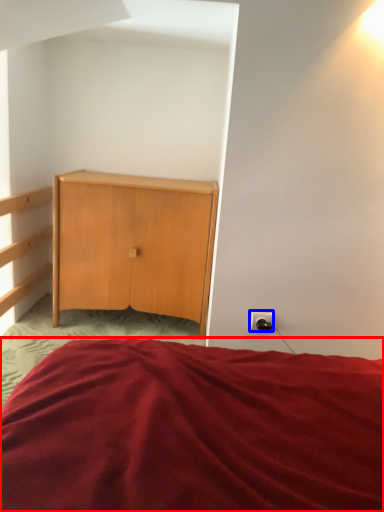
Question: Which object appears closest to the camera in this image, bed (highlighted by a red box) or electric outlet (highlighted by a blue box)?

Choices:
 (A) bed
 (B) electric outlet

Answer: (A)